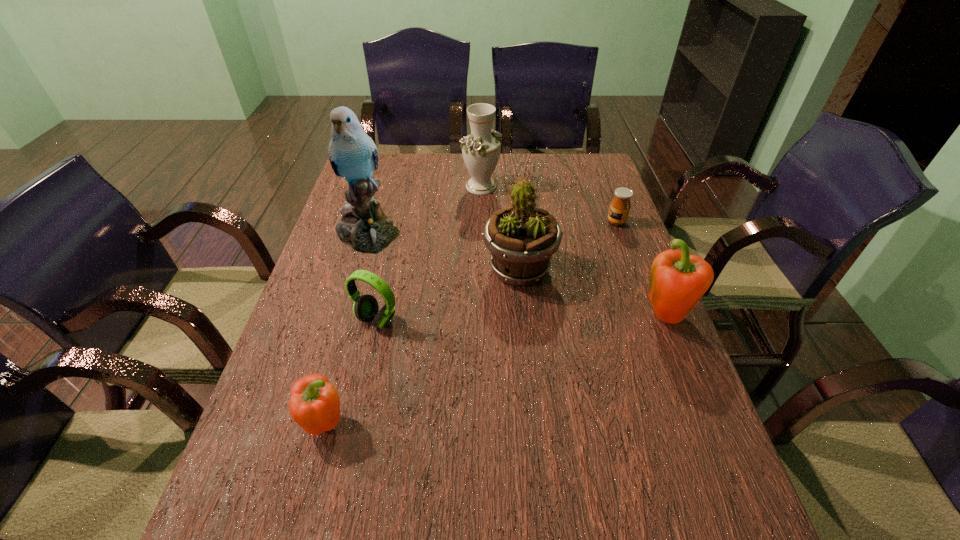
This screenshot has height=540, width=960. I want to click on vacant space at the far right corner of the desktop, so click(576, 156).

At what (x,y) coordinates should I click in order to perform the action: click on free point between the flowerpot and the left pepper. Please return your answer as a coordinate pair (x, y). This screenshot has height=540, width=960. Looking at the image, I should click on (423, 347).

Locate an element on the screen. empty space that is in between the vase and the headset is located at coordinates point(429,253).

Find the location of a particular element. free spot between the shortest object and the flowerpot is located at coordinates 568,246.

This screenshot has width=960, height=540. Find the location of `free space between the flowerpot and the headset`. free space between the flowerpot and the headset is located at coordinates (448, 295).

The width and height of the screenshot is (960, 540). What are the coordinates of `vacant area that lies between the taller pepper and the shortest object` in the screenshot? It's located at (641, 269).

I want to click on vacant space in between the headset and the farthest object, so click(x=429, y=253).

Choose which object is the sixth nearest neighbor to the vase. Please provide its 2D coordinates. Your answer should be formatted as a tuple, i.e. [(x, y)], where the tuple contains the x and y coordinates of a point satisfying the conditions above.

[(315, 404)]

Where is `the fifth closest object relative to the shorter pepper`? the fifth closest object relative to the shorter pepper is located at coordinates (481, 150).

Identify the location of vacant space that satisfies the following two spatial constraints: 1. on the front side of the taller pepper; 2. on the right side of the flowerpot. The height and width of the screenshot is (540, 960). (524, 317).